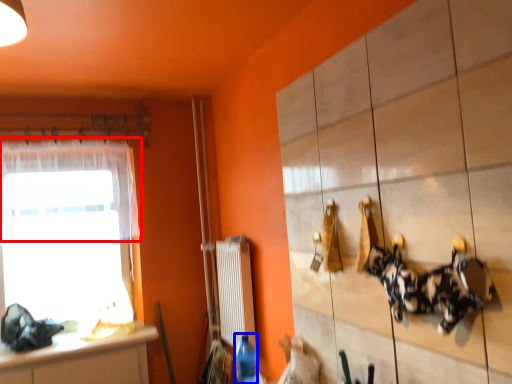
Question: Which object is closer to the camera taking this photo, curtain (highlighted by a red box) or bottle (highlighted by a blue box)?

Choices:
 (A) curtain
 (B) bottle

Answer: (B)